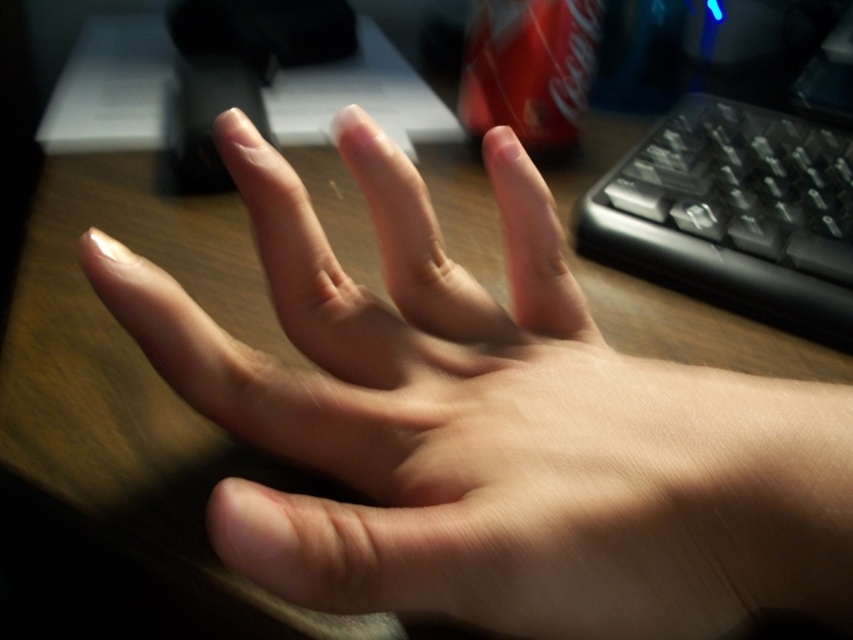
Where is `black plastic keyboard at right`? This screenshot has width=853, height=640. black plastic keyboard at right is located at coordinates (734, 212).

Between black plastic keyboard at right and matte red can at upper center, which one is positioned lower?

Positioned lower is black plastic keyboard at right.

Locate an element on the screen. Image resolution: width=853 pixels, height=640 pixels. black plastic keyboard at right is located at coordinates (734, 212).